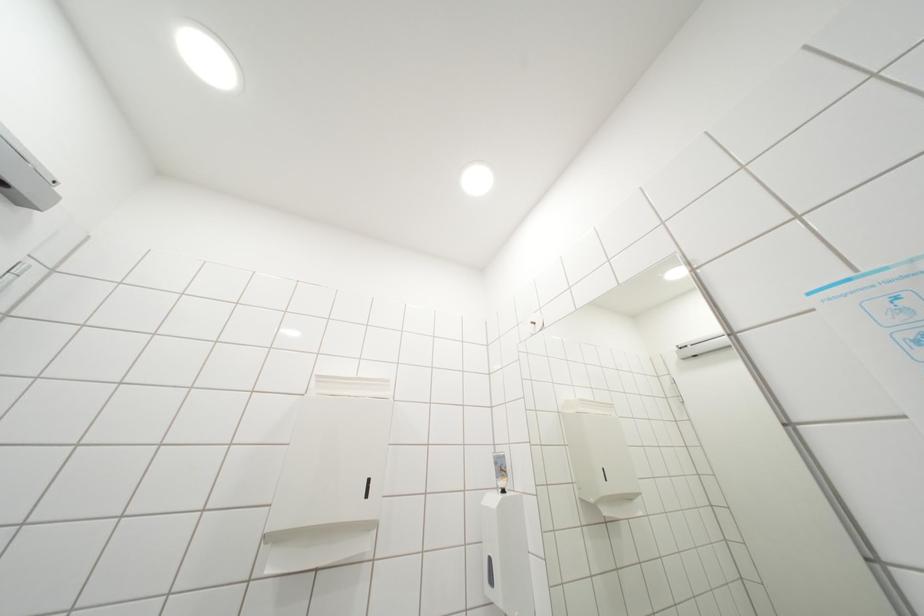
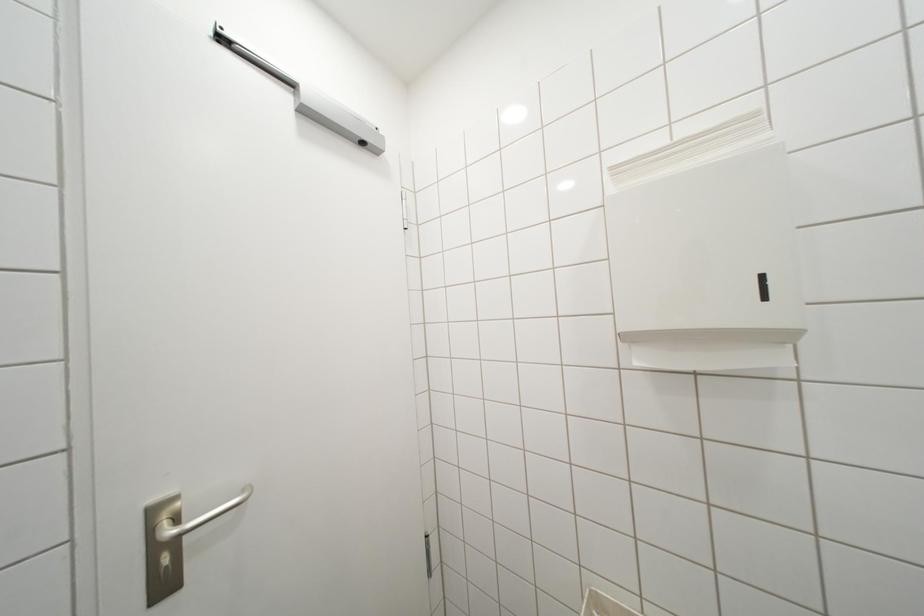
Question: How did the camera likely rotate?

Choices:
 (A) Left
 (B) Right
 (C) Up
 (D) Down

Answer: (A)